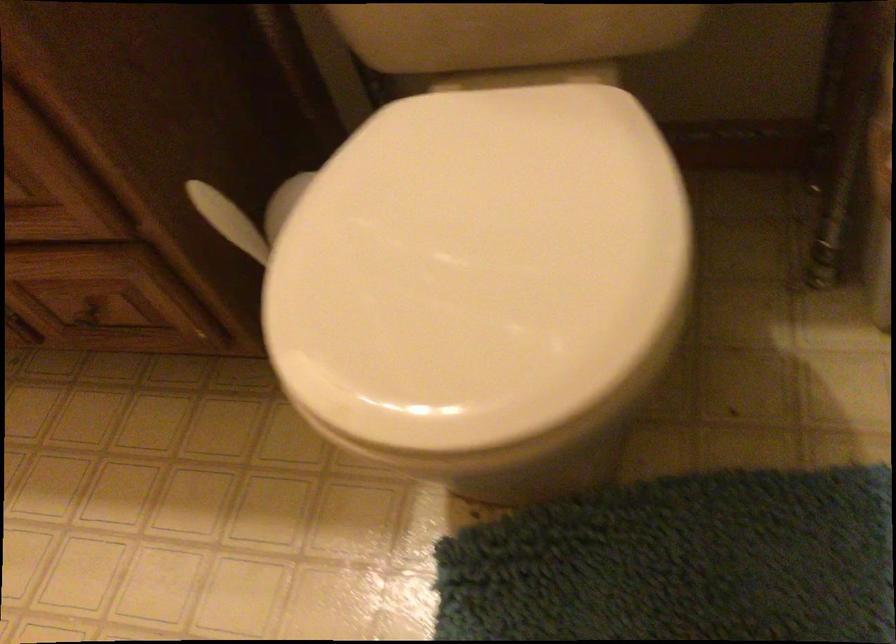
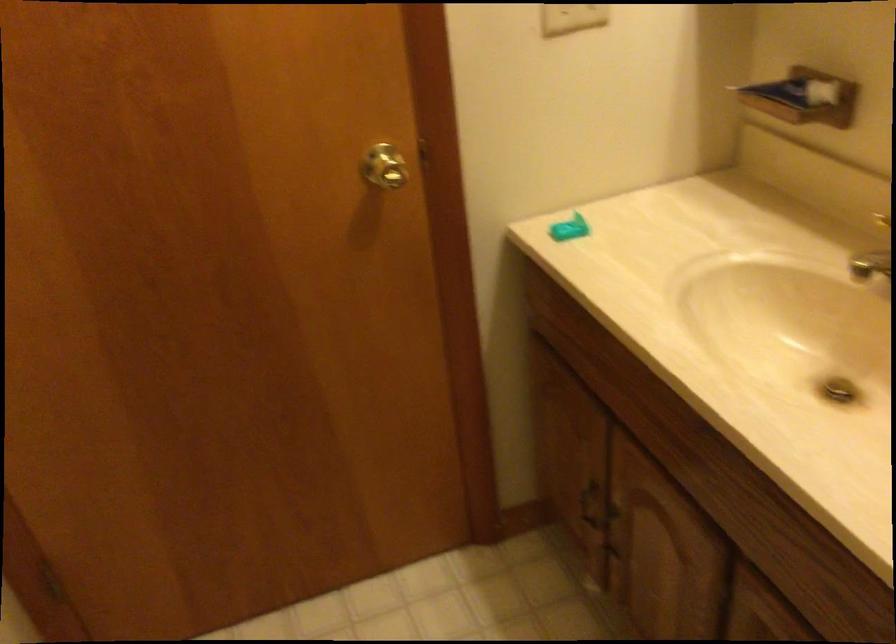
Question: The camera is either moving clockwise (left) or counter-clockwise (right) around the object. The first image is from the beginning of the video and the second image is from the end. Is the camera moving left or right when shooting the video?

Choices:
 (A) Left
 (B) Right

Answer: (B)